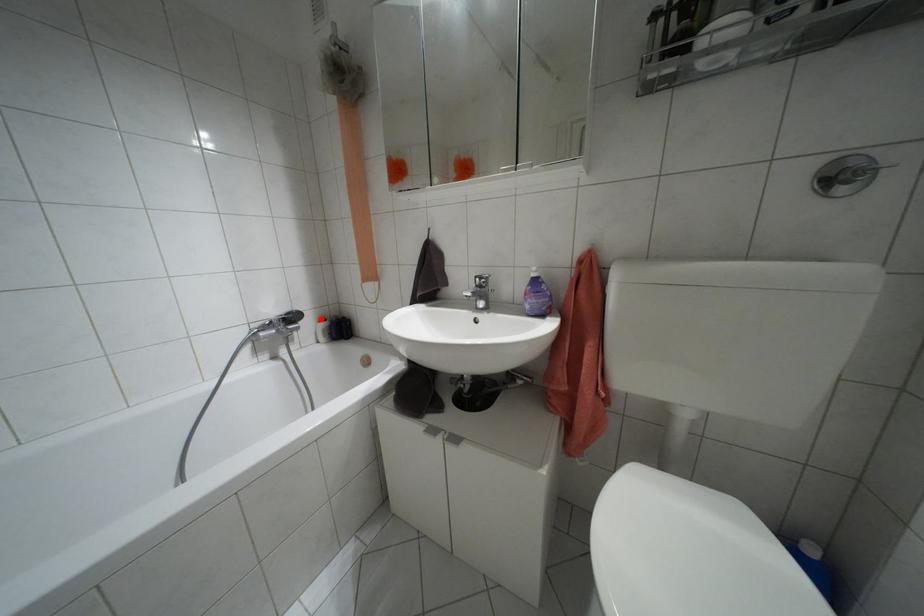
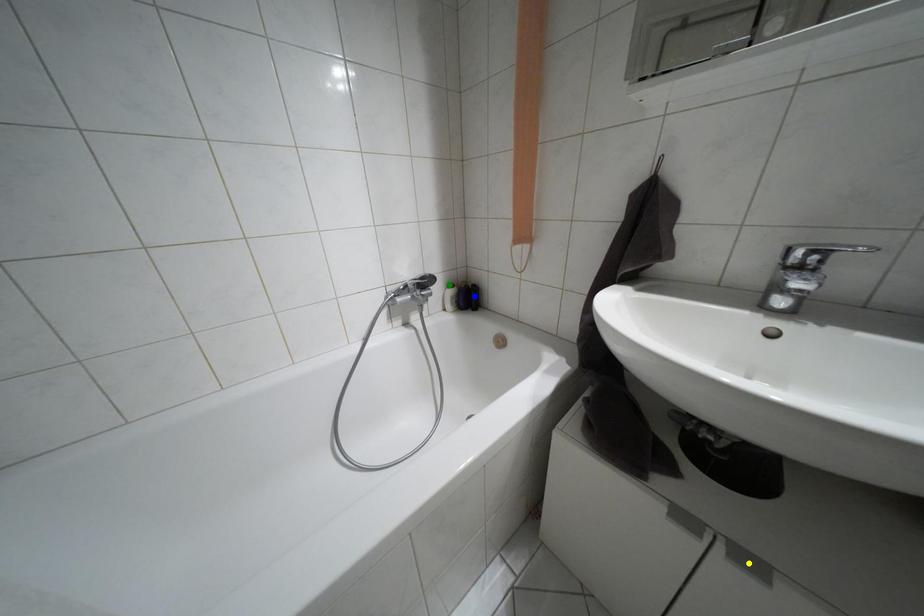
Question: I am providing you with two images of the same scene from different viewpoints. A red point is marked on the first image. You are given multiple points on the second image. Which spot in image 2 lines up with the point in image 1?

Choices:
 (A) blue point
 (B) green point
 (C) yellow point

Answer: (B)